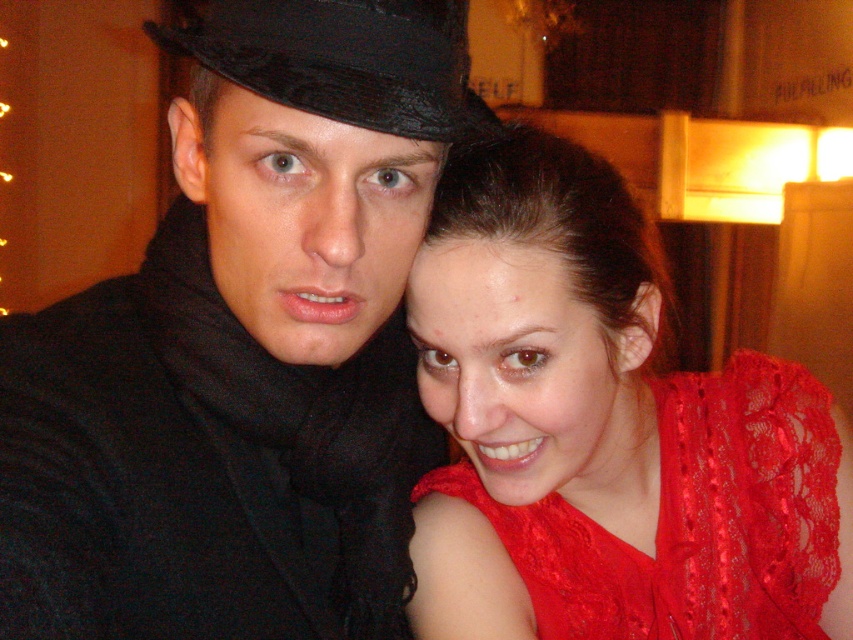
You are a photographer adjusting the focus on your camera. You want to ensure that both the matte black hat at upper center and the black satin fedora at upper left are in sharp focus. Which hat should you focus on first to achieve this?

You should focus on the matte black hat at upper center first because it is closer to the viewer than the black satin fedora at upper left. By focusing on the closer object, the farther one may still be in focus depending on the depth of field.

You are a photographer adjusting the lighting for a portrait. You notice the matte black hat at upper center and the lace fabric dress at upper right. Which object is covering part of the other?

The matte black hat at upper center is positioned over the lace fabric dress at upper right, so it is covering part of it.

You are a photographer adjusting the lighting in a studio. You notice the matte black hat at upper center and the lace fabric dress at upper right. Which object should you focus the light on first if you want to ensure both are well lit, considering their position?

The matte black hat at upper center is in front of the lace fabric dress at upper right, so you should focus the light on the matte black hat at upper center first to ensure it is properly illuminated before adjusting for the lace fabric dress at upper right.